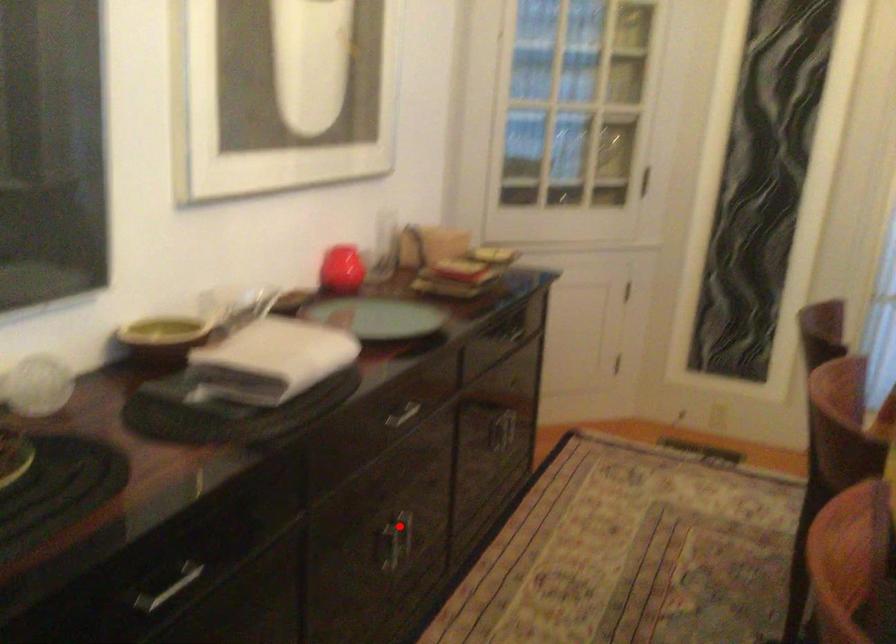
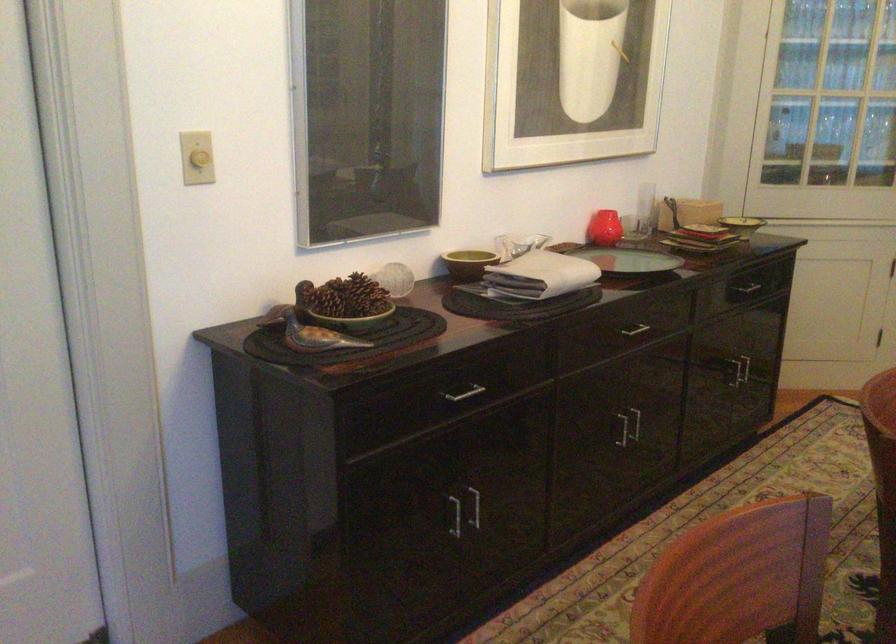
Question: I am providing you with two images of the same scene from different viewpoints. In image1, a red point is highlighted. Considering the same 3D point in image2, which of the following is correct?

Choices:
 (A) It is closer
 (B) It is farther

Answer: (B)